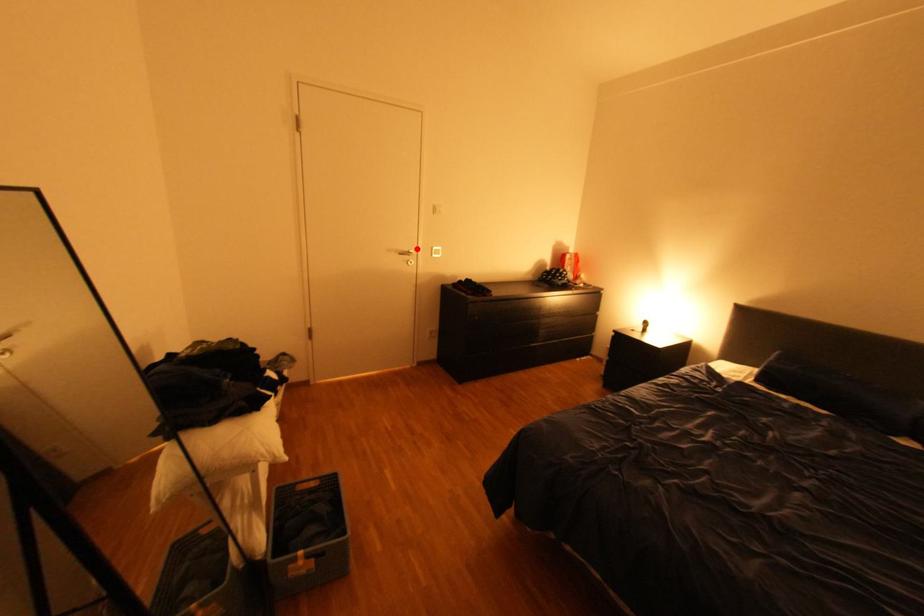
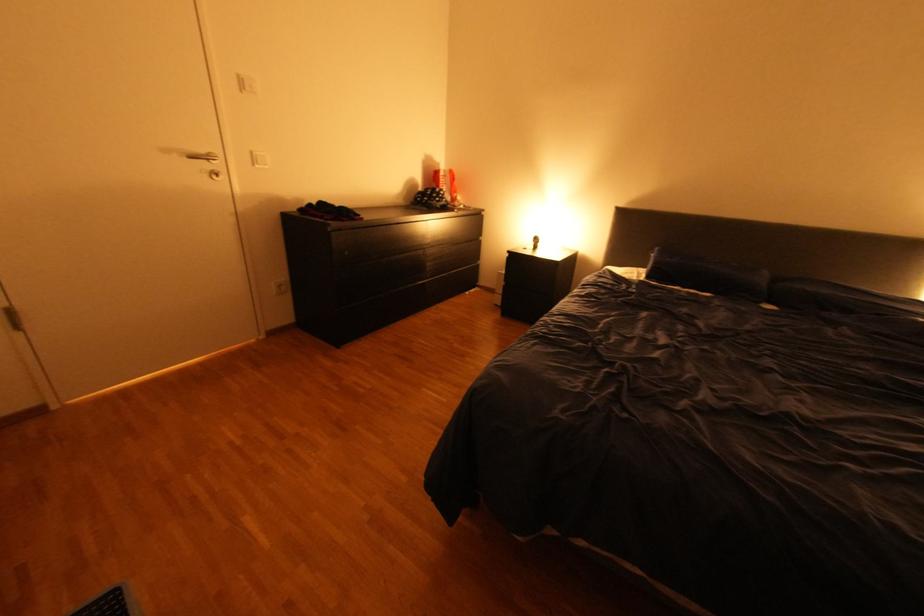
Question: A red point is marked in image1. In image2, is the corresponding 3D point closer to the camera or farther? Reply with the corresponding letter.

Choices:
 (A) The corresponding 3D point is closer.
 (B) The corresponding 3D point is farther.

Answer: (B)